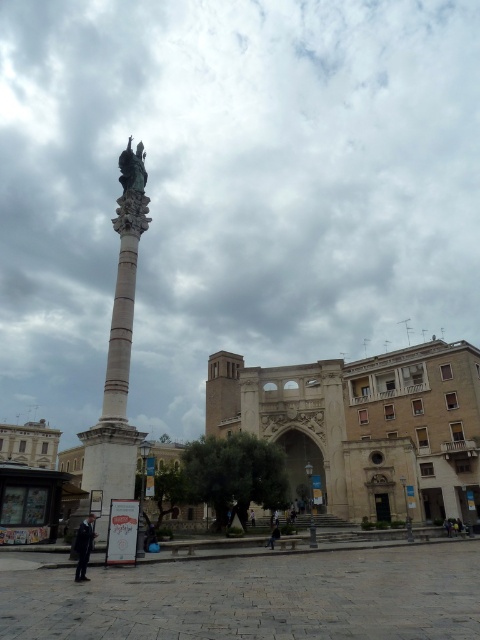
Does bronze statue at center appear under dark suit at lower left?

No.

Who is lower down, bronze statue at center or dark suit at lower left?

dark suit at lower left

Is point (124, 168) closer to camera compared to point (85, 566)?

No.

Locate an element on the screen. bronze statue at center is located at coordinates (119, 349).

Does point (103, 436) come closer to viewer compared to point (128, 188)?

Yes, point (103, 436) is in front of point (128, 188).

Who is positioned more to the left, bronze statue at center or bronze statue at upper center?

bronze statue at center

Between point (131, 476) and point (121, 180), which one is positioned in front?

Point (131, 476) is in front.

What are the coordinates of `bronze statue at center` in the screenshot? It's located at (119, 349).

Does white marble column at center appear on the left side of dark suit at lower left?

No, white marble column at center is not to the left of dark suit at lower left.

Is white marble column at center taller than dark suit at lower left?

Correct, white marble column at center is much taller as dark suit at lower left.

Between point (253, 385) and point (85, 532), which one is positioned behind?

Positioned behind is point (253, 385).

The width and height of the screenshot is (480, 640). I want to click on white marble column at center, so click(x=364, y=432).